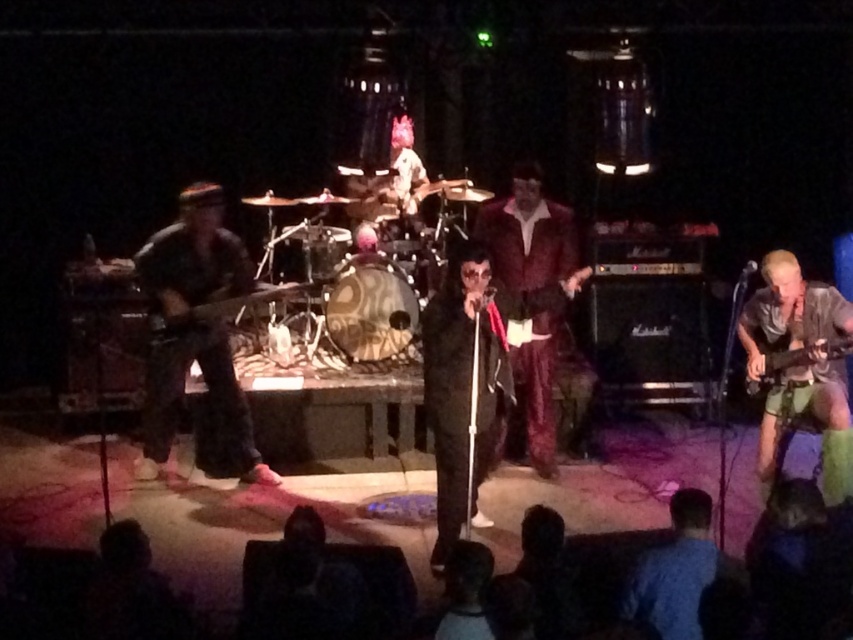
Between denim shorts at right and wooden electric guitar at center, which one is positioned higher?

wooden electric guitar at center

Consider the image. Is denim shorts at right closer to the viewer compared to wooden electric guitar at center?

Yes, it is.

Image resolution: width=853 pixels, height=640 pixels. Describe the element at coordinates (799, 368) in the screenshot. I see `denim shorts at right` at that location.

What are the coordinates of `denim shorts at right` in the screenshot? It's located at (799, 368).

Can you confirm if camouflage fabric guitar at left is positioned to the left of wooden electric guitar at center?

Yes, camouflage fabric guitar at left is to the left of wooden electric guitar at center.

Where is `camouflage fabric guitar at left`? The height and width of the screenshot is (640, 853). camouflage fabric guitar at left is located at coordinates (195, 330).

Locate an element on the screen. This screenshot has width=853, height=640. camouflage fabric guitar at left is located at coordinates (195, 330).

Who is lower down, denim shorts at right or metallic silver guitar at right?

denim shorts at right

Looking at this image, can you confirm if denim shorts at right is shorter than metallic silver guitar at right?

No.

Locate an element on the screen. denim shorts at right is located at coordinates (799, 368).